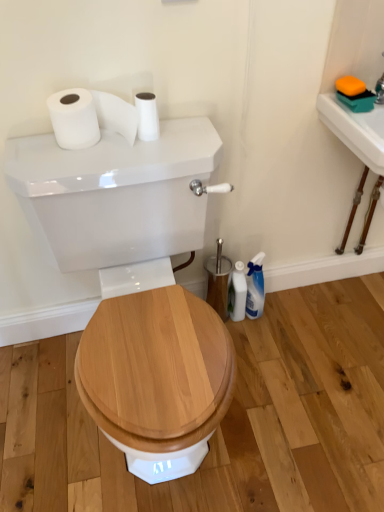
Question: Would you say white glossy toilet tank at center contains white glossy sink at upper right?

Choices:
 (A) yes
 (B) no

Answer: (B)

Question: Does white glossy toilet tank at center have a smaller size compared to white glossy sink at upper right?

Choices:
 (A) no
 (B) yes

Answer: (A)

Question: Is white glossy toilet tank at center bigger than white glossy sink at upper right?

Choices:
 (A) no
 (B) yes

Answer: (B)

Question: Does white glossy toilet tank at center have a greater width compared to white glossy sink at upper right?

Choices:
 (A) no
 (B) yes

Answer: (B)

Question: Can we say white glossy toilet tank at center lies outside white glossy sink at upper right?

Choices:
 (A) no
 (B) yes

Answer: (B)

Question: Considering the positions of white glossy toilet tank at center and white glossy sink at upper right in the image, is white glossy toilet tank at center taller or shorter than white glossy sink at upper right?

Choices:
 (A) short
 (B) tall

Answer: (B)

Question: Which is correct: white glossy toilet tank at center is inside white glossy sink at upper right, or outside of it?

Choices:
 (A) outside
 (B) inside

Answer: (A)

Question: Considering the relative positions of white glossy toilet tank at center and white glossy sink at upper right in the image provided, is white glossy toilet tank at center to the left or to the right of white glossy sink at upper right?

Choices:
 (A) left
 (B) right

Answer: (A)

Question: Considering the positions of white glossy toilet tank at center and white glossy sink at upper right in the image, is white glossy toilet tank at center bigger or smaller than white glossy sink at upper right?

Choices:
 (A) small
 (B) big

Answer: (B)

Question: Is white glossy toilet brush at lower right wider or thinner than white glossy toilet tank at center?

Choices:
 (A) thin
 (B) wide

Answer: (A)

Question: Is point (243, 273) closer or farther from the camera than point (175, 139)?

Choices:
 (A) closer
 (B) farther

Answer: (B)

Question: Looking at the image, does white glossy toilet brush at lower right seem bigger or smaller compared to white glossy toilet tank at center?

Choices:
 (A) big
 (B) small

Answer: (B)

Question: Is white glossy toilet brush at lower right situated inside white glossy toilet tank at center or outside?

Choices:
 (A) outside
 (B) inside

Answer: (A)

Question: Does point (238, 292) appear closer or farther from the camera than point (153, 132)?

Choices:
 (A) farther
 (B) closer

Answer: (A)

Question: Is white glossy toilet brush at lower right inside the boundaries of white matte toilet paper at upper center, which is counted as the second toilet paper, starting from the left, or outside?

Choices:
 (A) outside
 (B) inside

Answer: (A)